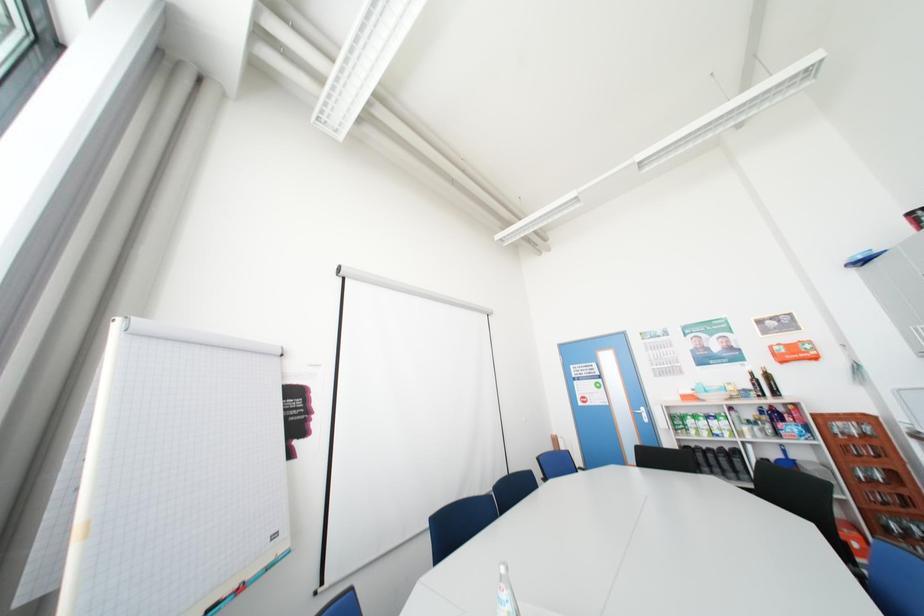
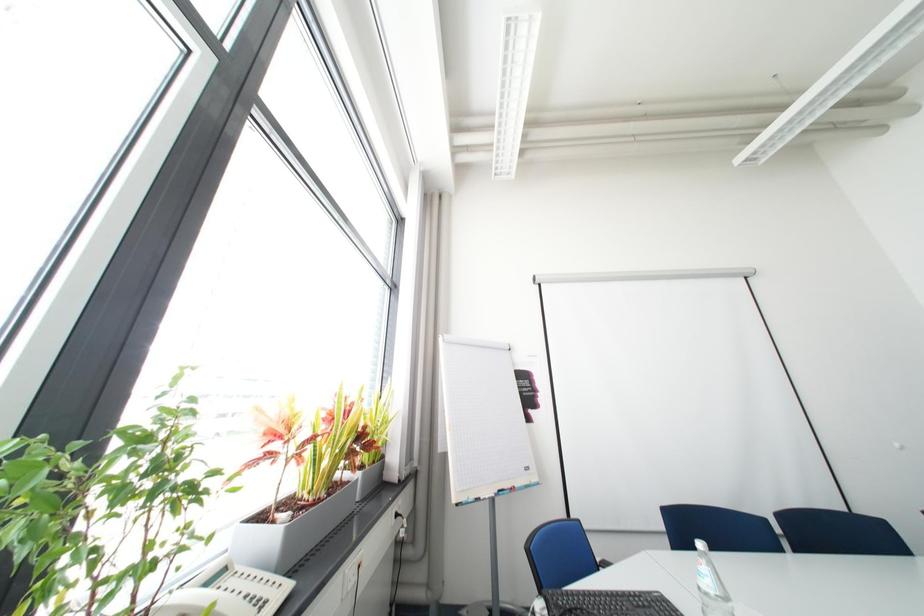
Question: The images are taken continuously from a first-person perspective. In which direction is your viewpoint rotating?

Choices:
 (A) Left
 (B) Right
 (C) Up
 (D) Down

Answer: (A)